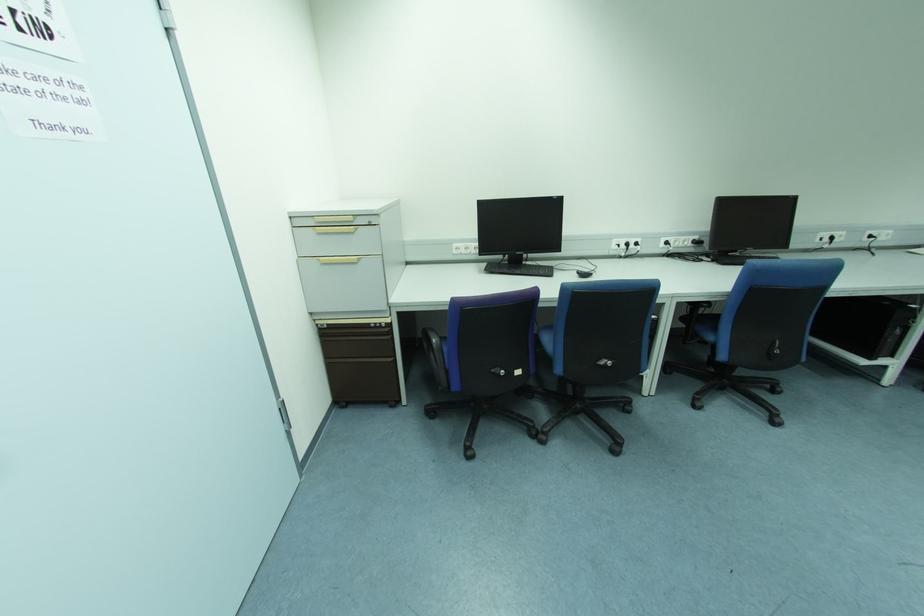
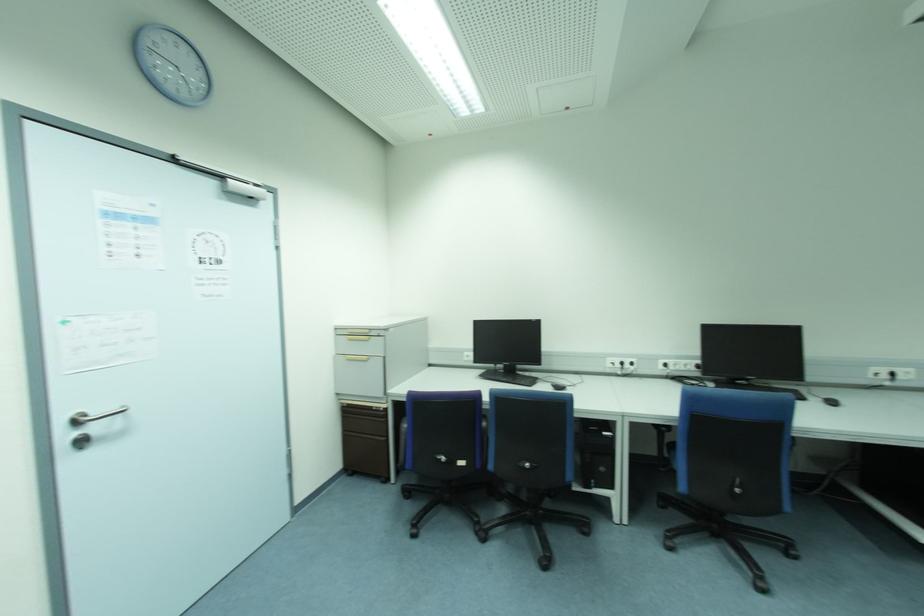
The images are taken continuously from a first-person perspective. In which direction are you moving?

The cameraman moved toward right, backward.